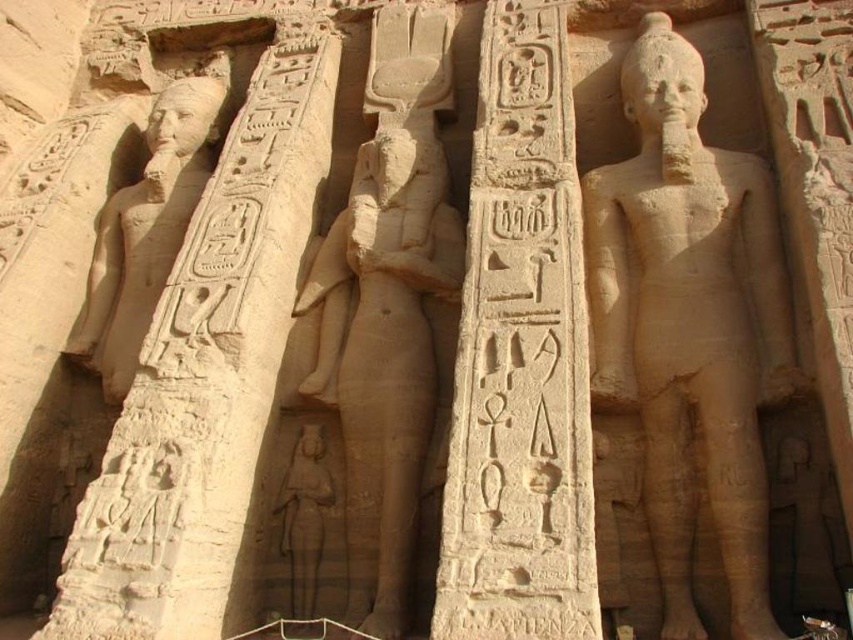
Which of these two, sandstone statue at center or smooth stone column at center, stands shorter?

smooth stone column at center is shorter.

Is sandstone statue at center thinner than smooth stone column at center?

No, sandstone statue at center is not thinner than smooth stone column at center.

Is point (624, 333) closer to camera compared to point (514, 600)?

No, (624, 333) is behind (514, 600).

Locate an element on the screen. This screenshot has width=853, height=640. sandstone statue at center is located at coordinates (689, 326).

Image resolution: width=853 pixels, height=640 pixels. What do you see at coordinates (689, 326) in the screenshot?
I see `sandstone statue at center` at bounding box center [689, 326].

Can you confirm if sandstone statue at center is shorter than sandstone statue at left?

Incorrect, sandstone statue at center's height does not fall short of sandstone statue at left's.

Which is behind, point (759, 545) or point (169, 106)?

Positioned behind is point (169, 106).

The height and width of the screenshot is (640, 853). Find the location of `sandstone statue at center`. sandstone statue at center is located at coordinates (689, 326).

From the picture: Is sandstone statue at center further to the viewer compared to smooth sandstone statue at center?

No, sandstone statue at center is closer to the viewer.

Is sandstone statue at center positioned in front of smooth sandstone statue at center?

Yes, sandstone statue at center is in front of smooth sandstone statue at center.

This screenshot has height=640, width=853. What do you see at coordinates (689, 326) in the screenshot?
I see `sandstone statue at center` at bounding box center [689, 326].

Identify the location of sandstone statue at center. Image resolution: width=853 pixels, height=640 pixels. (689, 326).